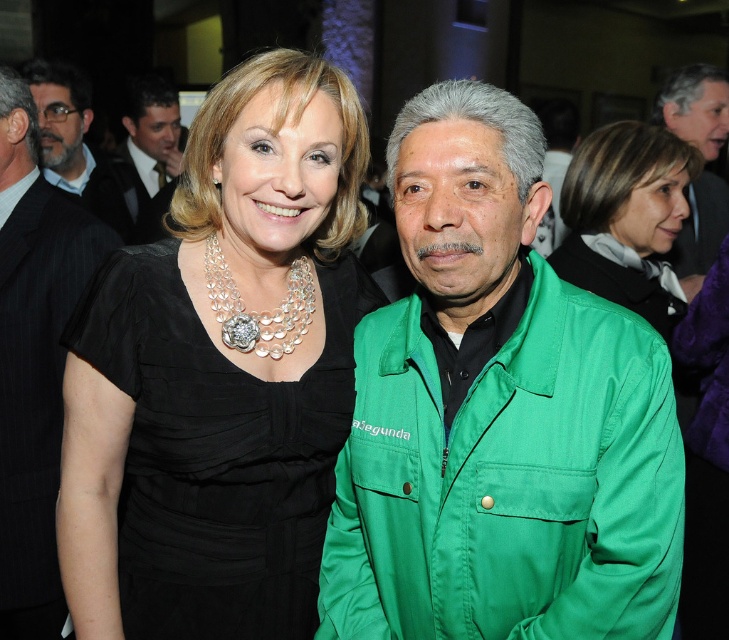
You are at a social event and see the black satin dress at center. Can you estimate its position in the image using coordinates?

The black satin dress at center is located at coordinates approximately 0.709 on the x axis and 0.299 on the y axis.

You are at a social event and see two people standing near you. The woman on the left is wearing a black dress with a statement necklace, and the man on the right is wearing a bright green jacket. There is a point marked at coordinates (498, 416). Based on the scene description, which object does this point correspond to?

The point at coordinates (498, 416) corresponds to the green fabric jacket at center, as stated in the objects description.

You are at a social event and need to adjust your outfit. You see the green fabric jacket at center and the matte black dress at center. Which one is positioned lower on your body?

The green fabric jacket at center is located below the matte black dress at center, so it is positioned lower on the body.